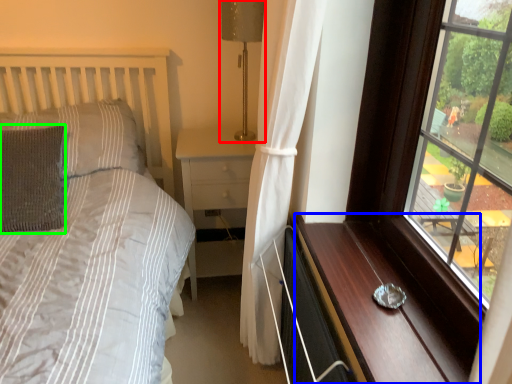
Question: Estimate the real-world distances between objects in this image. Which object is farther from table lamp (highlighted by a red box), dresser (highlighted by a blue box) or pillow (highlighted by a green box)?

Choices:
 (A) dresser
 (B) pillow

Answer: (A)